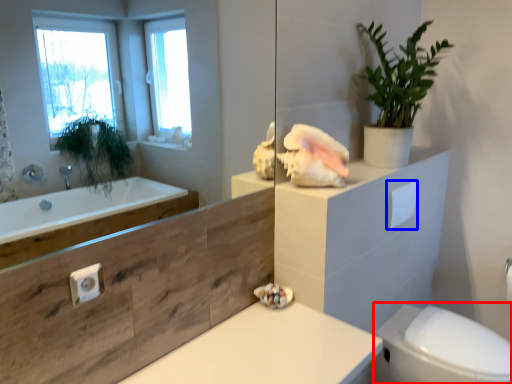
Question: Which of the following is the farthest to the observer, bidet (highlighted by a red box) or toilet paper (highlighted by a blue box)?

Choices:
 (A) bidet
 (B) toilet paper

Answer: (B)